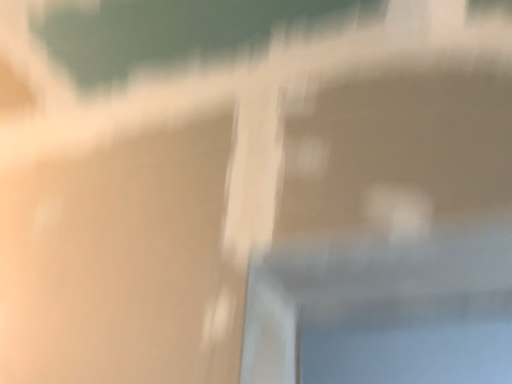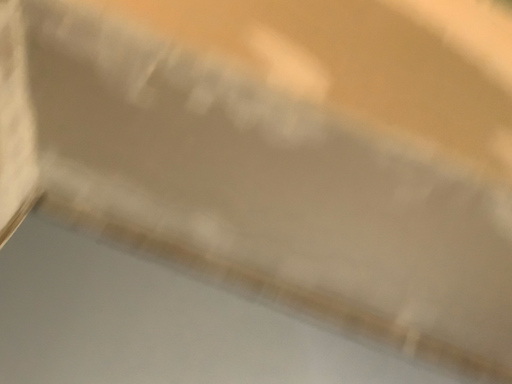
Question: Which way did the camera rotate in the video?

Choices:
 (A) rotated right
 (B) rotated left

Answer: (A)